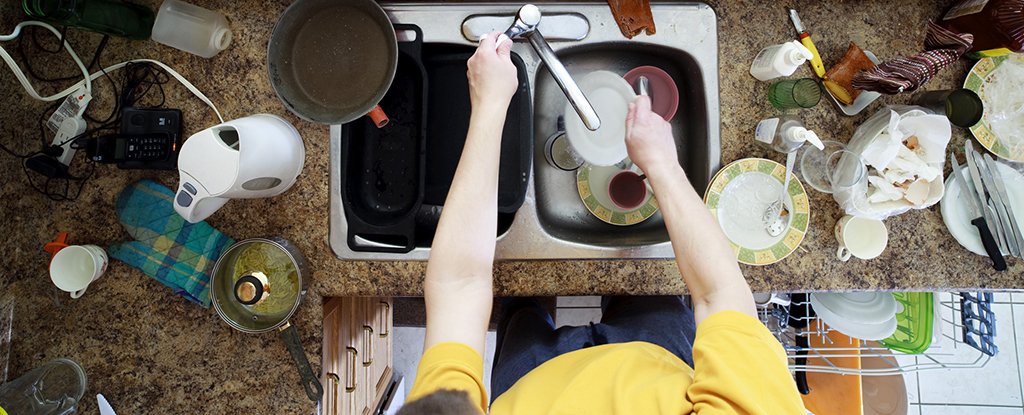
Image resolution: width=1024 pixels, height=415 pixels. I want to click on cooking pot, so click(x=278, y=286), click(x=352, y=69).